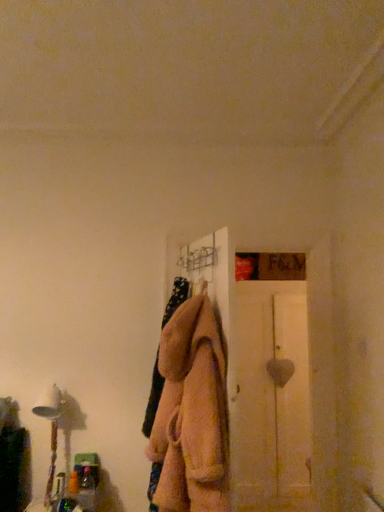
Question: From the image's perspective, is white fabric lampshade at left above or below white wooden door at right?

Choices:
 (A) below
 (B) above

Answer: (B)

Question: In terms of width, does white fabric lampshade at left look wider or thinner when compared to white wooden door at right?

Choices:
 (A) wide
 (B) thin

Answer: (B)

Question: Estimate the real-world distances between objects in this image. Which object is closer to the white fabric lampshade at left?

Choices:
 (A) fuzzy beige coat at center
 (B) white wooden door at right

Answer: (A)

Question: Considering the real-world distances, which object is farthest from the white fabric lampshade at left?

Choices:
 (A) white wooden door at right
 (B) fuzzy beige coat at center

Answer: (A)